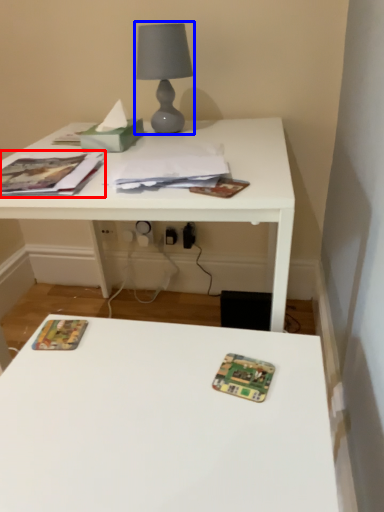
Question: Among these objects, which one is farthest to the camera, paperback book (highlighted by a red box) or table lamp (highlighted by a blue box)?

Choices:
 (A) paperback book
 (B) table lamp

Answer: (B)